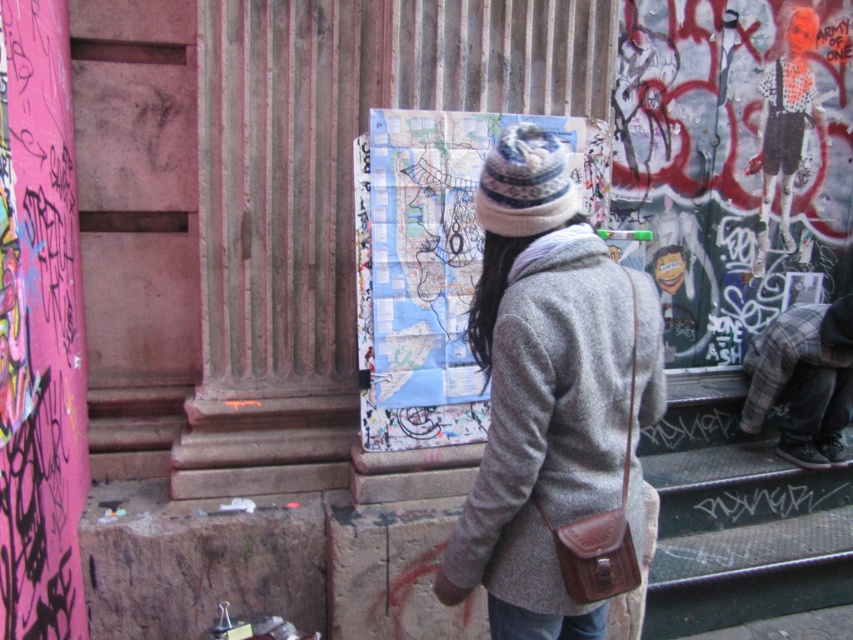
Question: Based on their relative distances, which object is farther from the blue denim jeans at lower center?

Choices:
 (A) plaid fabric pants at lower right
 (B) gray woolen coat at center

Answer: (A)

Question: Which object is the closest to the gray woolen coat at center?

Choices:
 (A) blue denim jeans at lower center
 (B) plaid fabric pants at lower right

Answer: (A)

Question: Is gray woolen coat at center positioned before plaid fabric pants at lower right?

Choices:
 (A) yes
 (B) no

Answer: (A)

Question: Is black metal stairs at lower right smaller than plaid fabric pants at lower right?

Choices:
 (A) no
 (B) yes

Answer: (A)

Question: Which of the following is the closest to the observer?

Choices:
 (A) (492, 616)
 (B) (795, 429)
 (C) (498, 440)
 (D) (822, 492)

Answer: (C)

Question: Is gray woolen coat at center positioned behind blue denim jeans at lower center?

Choices:
 (A) yes
 (B) no

Answer: (B)